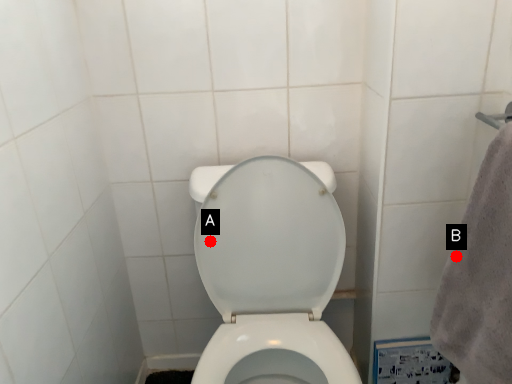
Question: Two points are circled on the image, labeled by A and B beside each circle. Among these points, which one is farthest from the camera?

Choices:
 (A) A is further
 (B) B is further

Answer: (A)